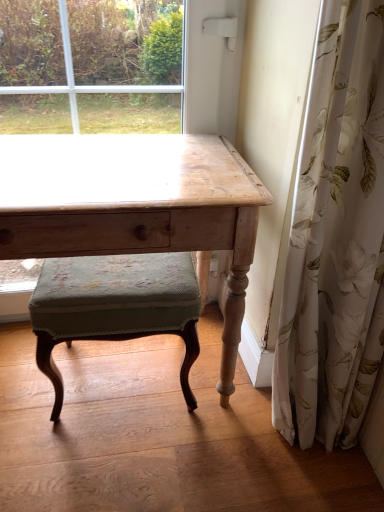
The width and height of the screenshot is (384, 512). Identify the location of free space in front of velvet green cushioned stool at center. (127, 473).